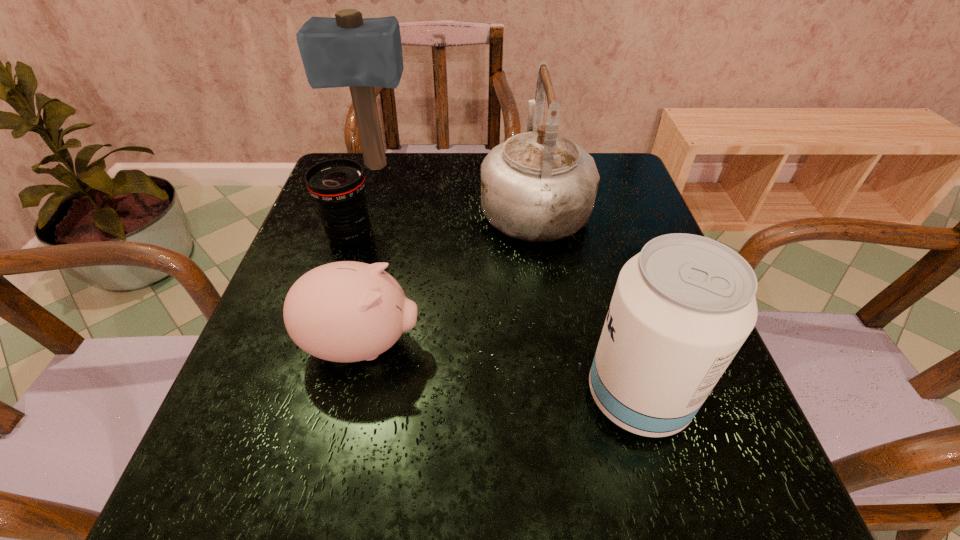
The image size is (960, 540). Find the location of `free space that is in between the alcohol and the mallet`. free space that is in between the alcohol and the mallet is located at coordinates (506, 281).

Where is `free space between the piggy bank and the kettle`? This screenshot has height=540, width=960. free space between the piggy bank and the kettle is located at coordinates (448, 275).

Where is `unoccupied position between the piggy bank and the alcohol`? The image size is (960, 540). unoccupied position between the piggy bank and the alcohol is located at coordinates (500, 370).

You are a GUI agent. You are given a task and a screenshot of the screen. Output one action in this format:
    pyautogui.click(x=<x>, y=<y>)
    Task: Click on the vacant point located between the kettle and the alcohol
    
    Given the screenshot: What is the action you would take?
    (x=586, y=301)

You are a GUI agent. You are given a task and a screenshot of the screen. Output one action in this format:
    pyautogui.click(x=<x>, y=<y>)
    Task: Click on the object that stands as the second closest to the piggy bank
    The height and width of the screenshot is (540, 960).
    Given the screenshot: What is the action you would take?
    pyautogui.click(x=538, y=186)

Locate an element on the screen. the closest object to the mallet is located at coordinates (337, 185).

This screenshot has width=960, height=540. Find the location of `free location that satisfies the following two spatial constraints: 1. at the snout of the piggy bank; 2. on the right side of the alcohol`. free location that satisfies the following two spatial constraints: 1. at the snout of the piggy bank; 2. on the right side of the alcohol is located at coordinates (350, 396).